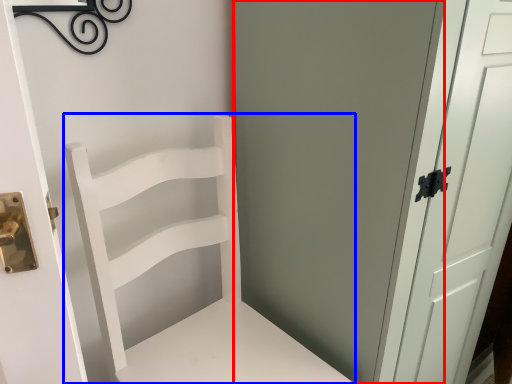
Question: Which point is closer to the camera, screen door (highlighted by a red box) or chair (highlighted by a blue box)?

Choices:
 (A) screen door
 (B) chair

Answer: (B)